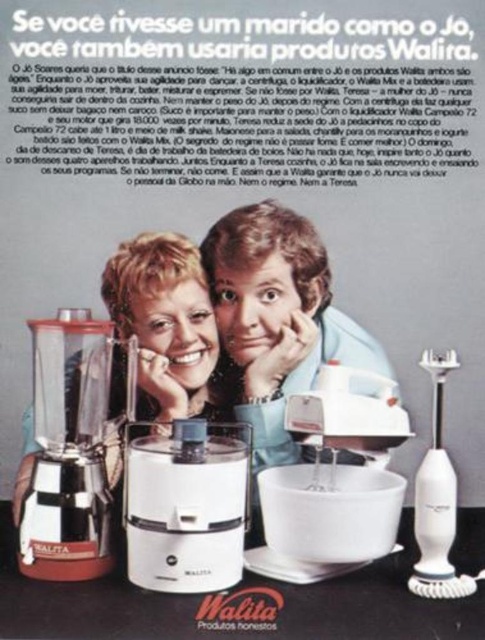
Question: Which of the following is the closest to the observer?

Choices:
 (A) matte black blender at lower left
 (B) white plastic bowl at center

Answer: (B)

Question: Does white plastic mixer at center appear over matte black blender at lower left?

Choices:
 (A) yes
 (B) no

Answer: (B)

Question: Can you confirm if matte white hairdryer at center is positioned below white plastic hand blender at right?

Choices:
 (A) no
 (B) yes

Answer: (A)

Question: Considering the real-world distances, which object is closest to the white plastic mixer at center?

Choices:
 (A) white plastic food processor at center
 (B) metallic silver mixer at center

Answer: (A)

Question: Which object appears closest to the camera in this image?

Choices:
 (A) metallic silver mixer at center
 (B) white plastic hand blender at right

Answer: (B)

Question: Is white plastic food processor at center further to the viewer compared to white plastic hand blender at right?

Choices:
 (A) no
 (B) yes

Answer: (B)